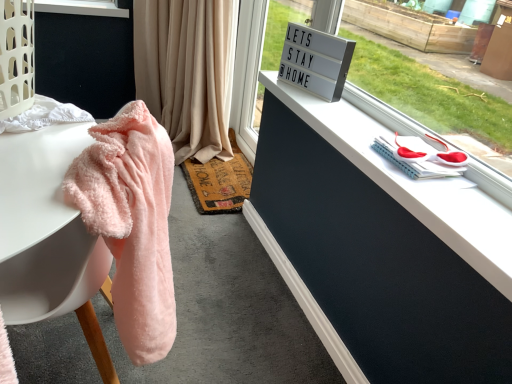
Identify the location of vacant area to the right of fluffy pink towel at left. This screenshot has width=512, height=384. click(227, 354).